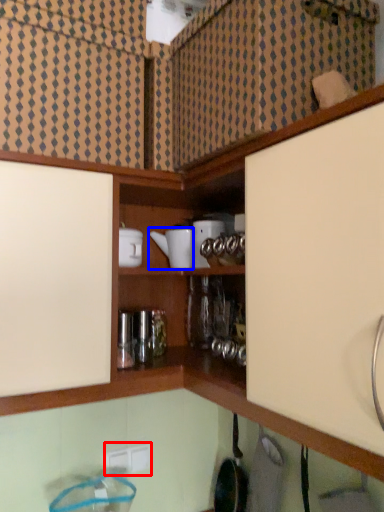
Question: Which point is further to the camera, electric outlet (highlighted by a red box) or appliance (highlighted by a blue box)?

Choices:
 (A) electric outlet
 (B) appliance

Answer: (A)